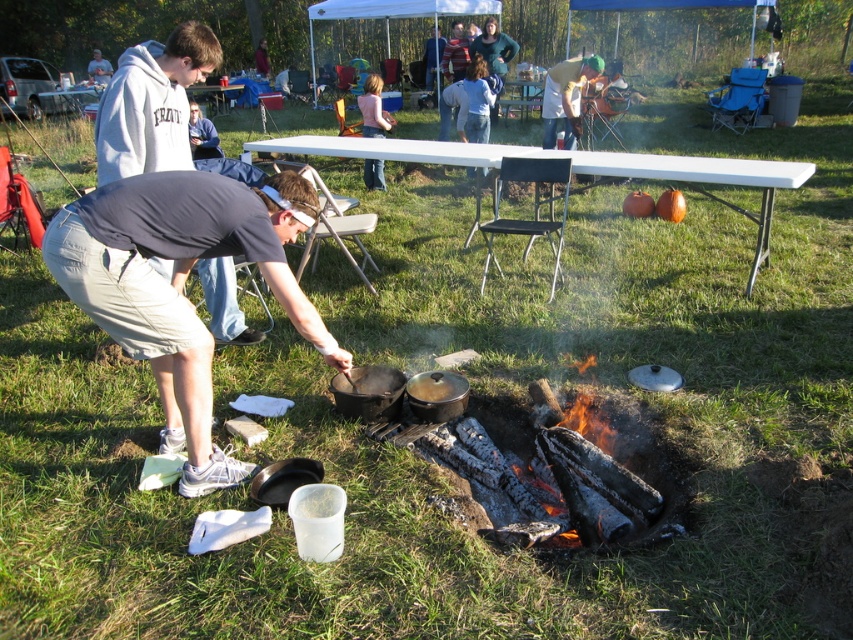
You are planning to set up a small tablecloth for a picnic on the white plastic picnic table at upper center and the pink fabric shirt at center. Which object can accommodate a larger tablecloth?

The white plastic picnic table at upper center is larger in size than the pink fabric shirt at center, so it can accommodate a larger tablecloth.

You are organizing a clothing donation drive and need to sort shirts by size. You find a gray cotton shirt at center and a pink fabric shirt at center. Which shirt should you place in the large size bin?

The gray cotton shirt at center is larger in size than the pink fabric shirt at center, so you should place the gray cotton shirt at center in the large size bin.